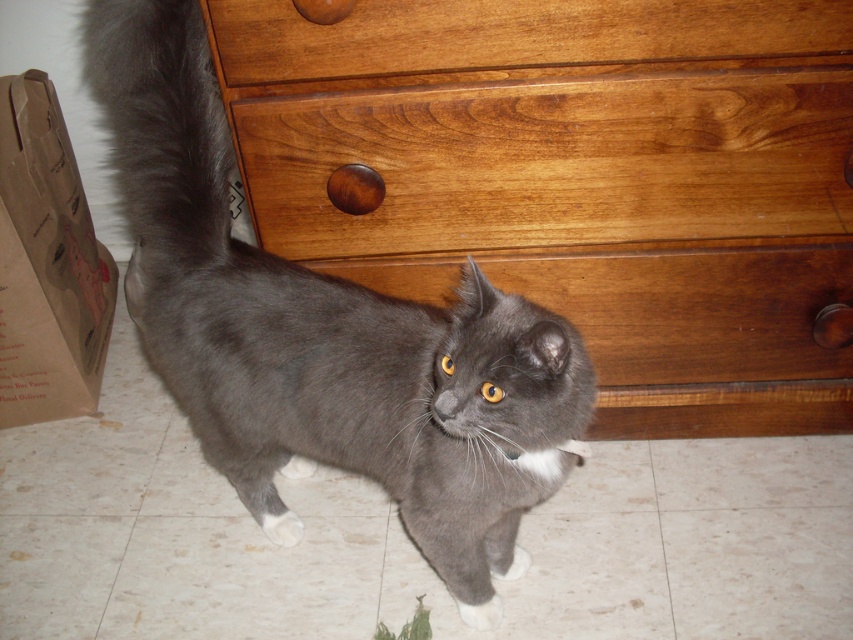
You are a cat owner who wants to ensure your cat can comfortably interact with both the wooden drawer at upper center and the white fur paw at lower center. Given their sizes, which object might require more space considerations for the cat to reach or touch?

The wooden drawer at upper center is larger in size than the white fur paw at lower center, so it might require more space considerations for the cat to reach or touch due to its bigger size.

You are a cat owner who wants to ensure your cat can comfortably sit on the wooden drawer at center without its white fur paw at lower center hanging off the edge. Based on the scene, can the cat fit on the drawer?

The wooden drawer at center is larger in size than the white fur paw at lower center, so the cat should be able to sit comfortably on the wooden drawer at center without its paws hanging off the edge.